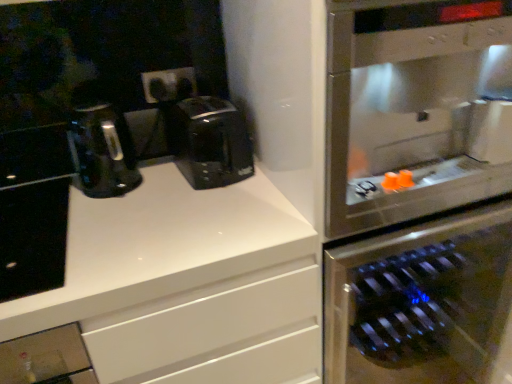
Question: Can you confirm if stainless steel oven at right is smaller than stainless steel wine cooler at right?

Choices:
 (A) yes
 (B) no

Answer: (A)

Question: From a real-world perspective, is stainless steel oven at right positioned under stainless steel wine cooler at right based on gravity?

Choices:
 (A) no
 (B) yes

Answer: (B)

Question: From a real-world perspective, does stainless steel oven at right stand above stainless steel wine cooler at right?

Choices:
 (A) no
 (B) yes

Answer: (A)

Question: Is stainless steel oven at right touching stainless steel wine cooler at right?

Choices:
 (A) yes
 (B) no

Answer: (A)

Question: From the image's perspective, would you say stainless steel oven at right is positioned over stainless steel wine cooler at right?

Choices:
 (A) no
 (B) yes

Answer: (A)

Question: Considering the relative positions of black plastic coffee maker at center and white glossy countertop at upper left in the image provided, is black plastic coffee maker at center to the left or to the right of white glossy countertop at upper left?

Choices:
 (A) right
 (B) left

Answer: (A)

Question: Does point (174, 130) appear closer or farther from the camera than point (77, 249)?

Choices:
 (A) closer
 (B) farther

Answer: (B)

Question: Do you think black plastic coffee maker at center is within white glossy countertop at upper left, or outside of it?

Choices:
 (A) inside
 (B) outside

Answer: (B)

Question: Considering their positions, is black plastic coffee maker at center located in front of or behind white glossy countertop at upper left?

Choices:
 (A) front
 (B) behind

Answer: (B)

Question: In terms of height, does stainless steel wine cooler at right look taller or shorter compared to black matte cabinet at left?

Choices:
 (A) short
 (B) tall

Answer: (B)

Question: Based on their positions, is stainless steel wine cooler at right located to the left or right of black matte cabinet at left?

Choices:
 (A) left
 (B) right

Answer: (B)

Question: Is stainless steel wine cooler at right bigger or smaller than black matte cabinet at left?

Choices:
 (A) big
 (B) small

Answer: (A)

Question: In the image, is stainless steel wine cooler at right positioned in front of or behind black matte cabinet at left?

Choices:
 (A) front
 (B) behind

Answer: (A)

Question: Based on their sizes in the image, would you say black matte cabinet at left is bigger or smaller than black plastic outlets at center?

Choices:
 (A) small
 (B) big

Answer: (B)

Question: Considering their positions, is black matte cabinet at left located in front of or behind black plastic outlets at center?

Choices:
 (A) front
 (B) behind

Answer: (A)